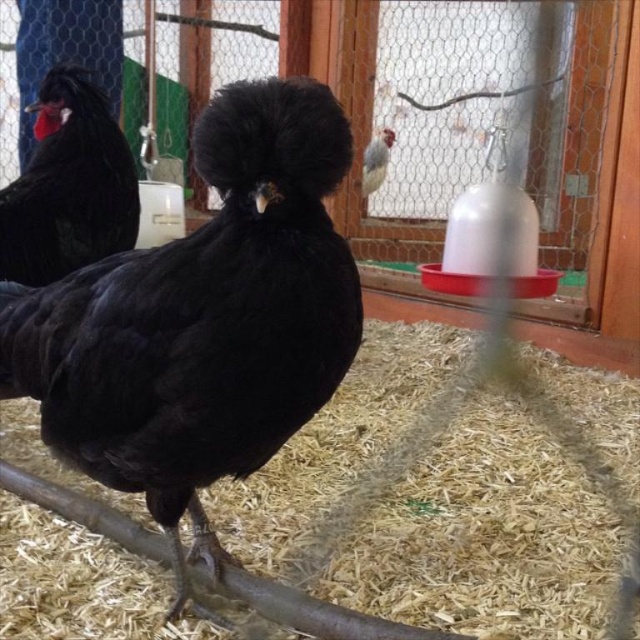
Does brown shredded hay at center appear on the left side of matte black chicken at left?

In fact, brown shredded hay at center is to the right of matte black chicken at left.

Image resolution: width=640 pixels, height=640 pixels. In order to click on brown shredded hay at center in this screenshot , I will do `click(486, 536)`.

Who is more forward, (54,602) or (35,129)?

Point (54,602)

What are the coordinates of `brown shredded hay at center` in the screenshot? It's located at (486, 536).

Is brown shredded hay at center closer to camera compared to speckled feathered chicken at upper center?

Yes.

Between brown shredded hay at center and speckled feathered chicken at upper center, which one appears on the right side from the viewer's perspective?

speckled feathered chicken at upper center

Locate an element on the screen. brown shredded hay at center is located at coordinates (486, 536).

Locate an element on the screen. This screenshot has height=640, width=640. brown shredded hay at center is located at coordinates (486, 536).

Between black feathered chicken at center and speckled feathered chicken at upper center, which one has more height?

black feathered chicken at center is taller.

Locate an element on the screen. black feathered chicken at center is located at coordinates pos(204,321).

Image resolution: width=640 pixels, height=640 pixels. What are the coordinates of `black feathered chicken at center` in the screenshot? It's located at (204, 321).

Identify the location of black feathered chicken at center. (204, 321).